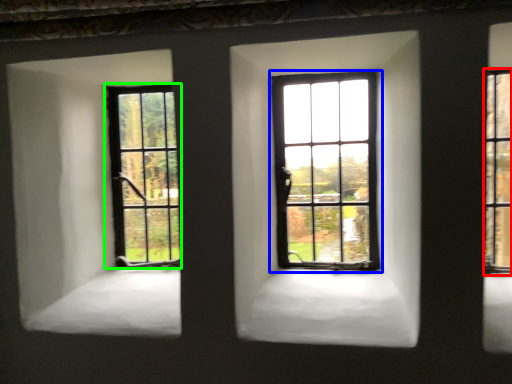
Question: Which object is positioned farthest from window (highlighted by a red box)? Select from window (highlighted by a blue box) and window (highlighted by a green box).

Choices:
 (A) window
 (B) window

Answer: (B)